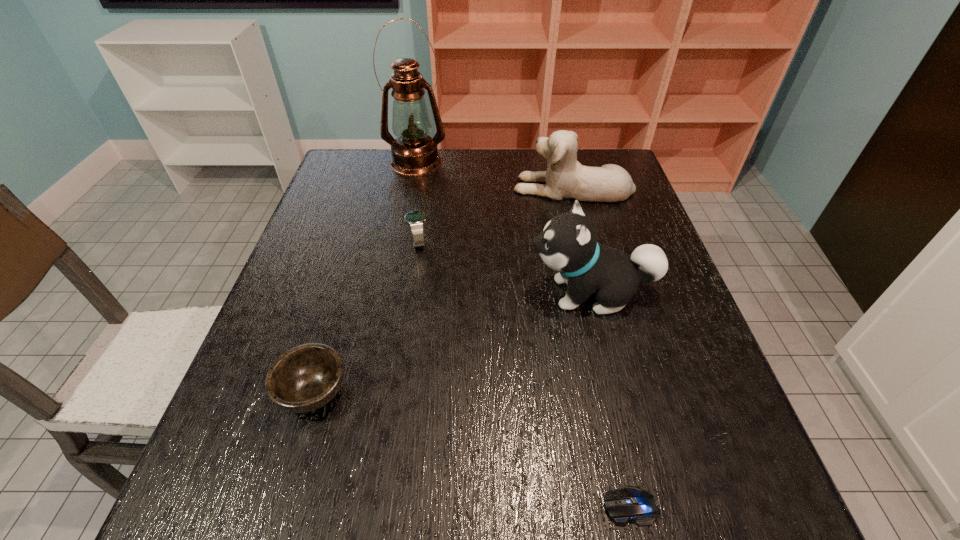
The width and height of the screenshot is (960, 540). Find the location of `oil lamp`. oil lamp is located at coordinates (414, 152).

Locate an element on the screen. the taller puppy is located at coordinates (568, 244).

The image size is (960, 540). Find the location of `the nearer puppy`. the nearer puppy is located at coordinates (568, 244).

Find the location of a particular element. the third tallest object is located at coordinates (565, 178).

At what (x,y) coordinates should I click in order to perform the action: click on the shorter puppy. Please return your answer as a coordinate pair (x, y). The width and height of the screenshot is (960, 540). Looking at the image, I should click on (565, 178).

This screenshot has height=540, width=960. I want to click on the fourth nearest object, so click(415, 219).

Identify the location of the third shortest object. This screenshot has width=960, height=540. (415, 219).

Locate an element on the screen. The image size is (960, 540). the fifth farthest object is located at coordinates (305, 378).

In order to click on the second shortest object in this screenshot , I will do `click(305, 378)`.

What are the coordinates of `computer mouse` in the screenshot? It's located at (631, 503).